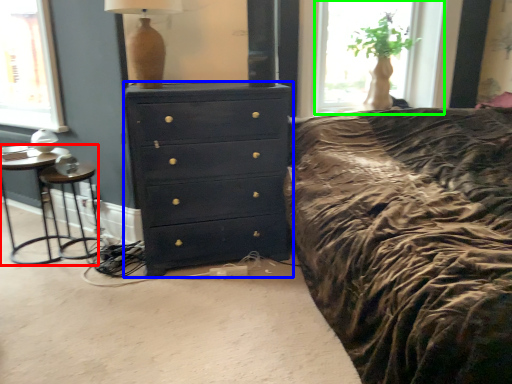
Question: Based on their relative distances, which object is nearer to nightstand (highlighted by a red box)? Choose from chest of drawers (highlighted by a blue box) and window (highlighted by a green box).

Choices:
 (A) chest of drawers
 (B) window

Answer: (A)